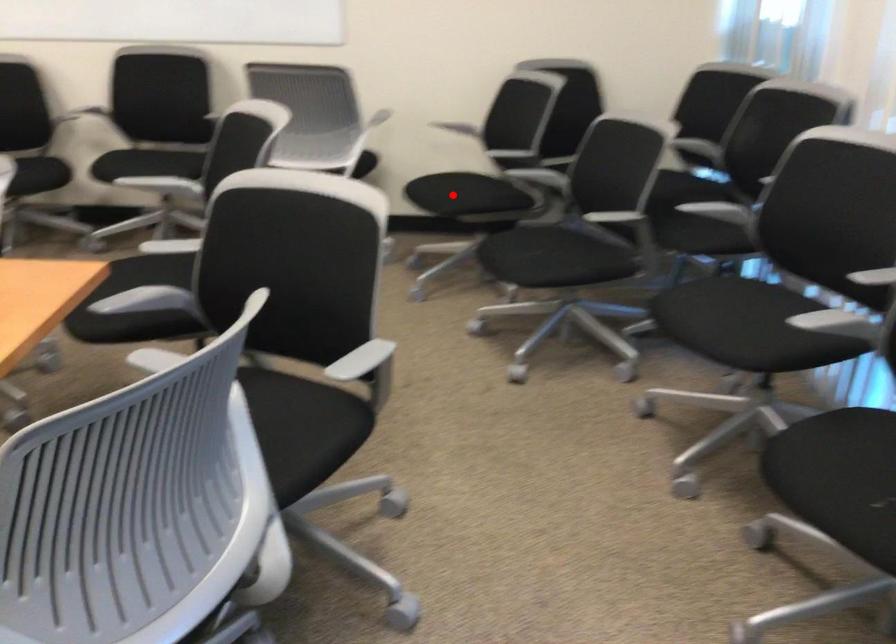
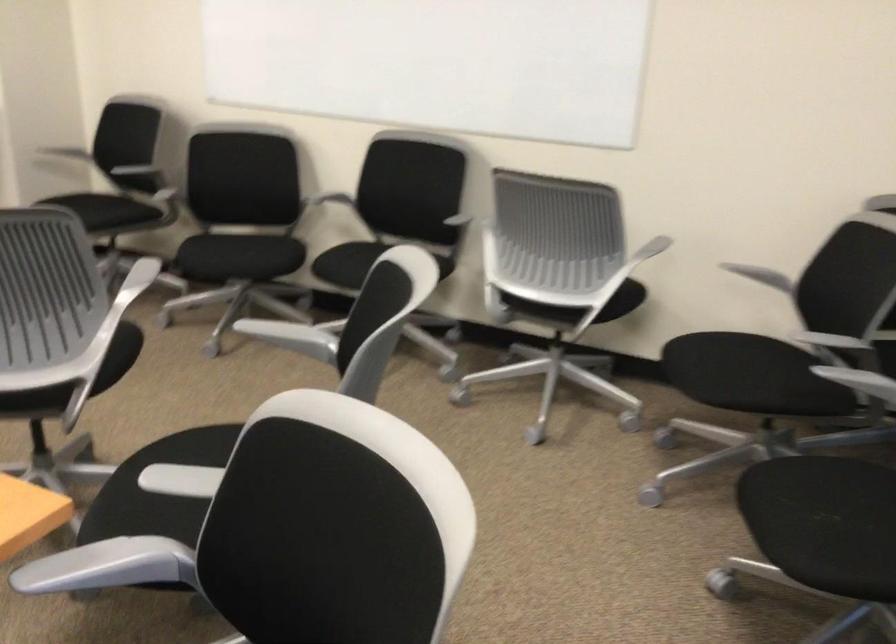
Question: I am providing you with two images of the same scene from different viewpoints. Image1 has a red point marked. In image2, the corresponding 3D location appears at what relative position? Reply with the corresponding letter.

Choices:
 (A) Closer
 (B) Farther

Answer: (A)